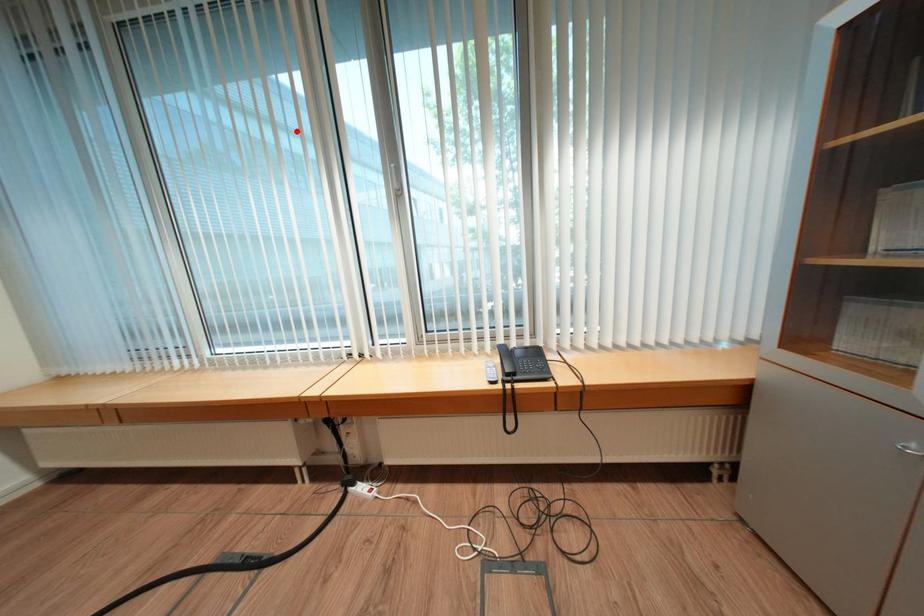
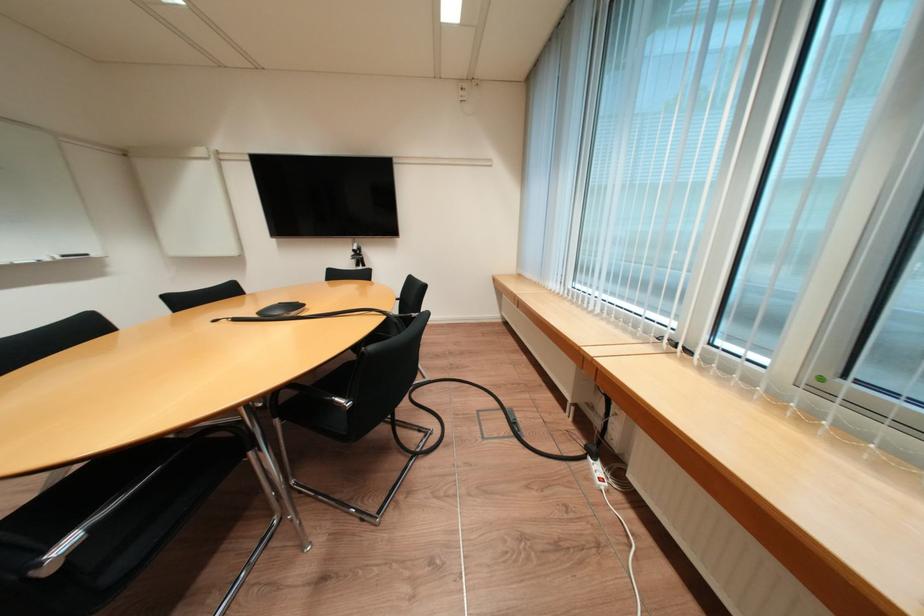
The point at the highlighted location is marked in the first image. Where is the corresponding point in the second image?

(740, 15)